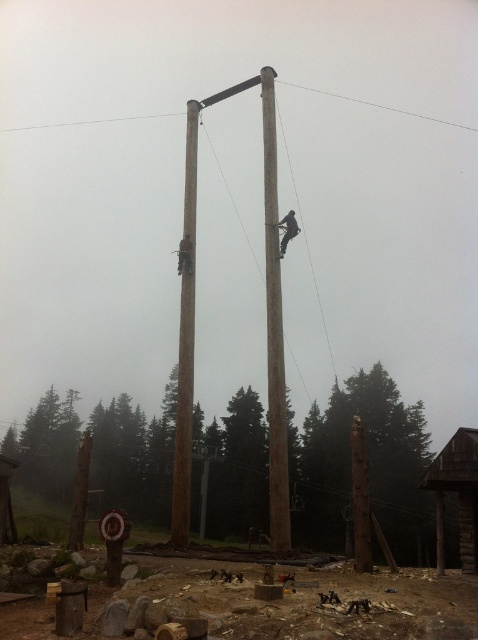
Question: Which object is farther from the camera taking this photo?

Choices:
 (A) brown rough wooden post at lower center
 (B) brown wooden telegraph pole at center
 (C) dark brown wooden pole at upper center
 (D) brown rough wooden pole at center

Answer: (A)

Question: Is brown wooden telegraph pole at center thinner than brown rough wooden pole at center?

Choices:
 (A) no
 (B) yes

Answer: (B)

Question: Does wooden pole at center appear under dark brown wooden pole at upper center?

Choices:
 (A) yes
 (B) no

Answer: (A)

Question: Which point is farther to the camera?

Choices:
 (A) (187, 378)
 (B) (282, 252)
 (C) (269, 461)
 (D) (380, 108)

Answer: (D)

Question: Considering the relative positions of brown rough wooden post at lower center and dark brown wooden pole at upper center in the image provided, where is brown rough wooden post at lower center located with respect to dark brown wooden pole at upper center?

Choices:
 (A) below
 (B) above

Answer: (A)

Question: Among these points, which one is farthest from the camera?

Choices:
 (A) (187, 250)
 (B) (291, 218)
 (C) (273, 497)
 (D) (187, 208)

Answer: (D)